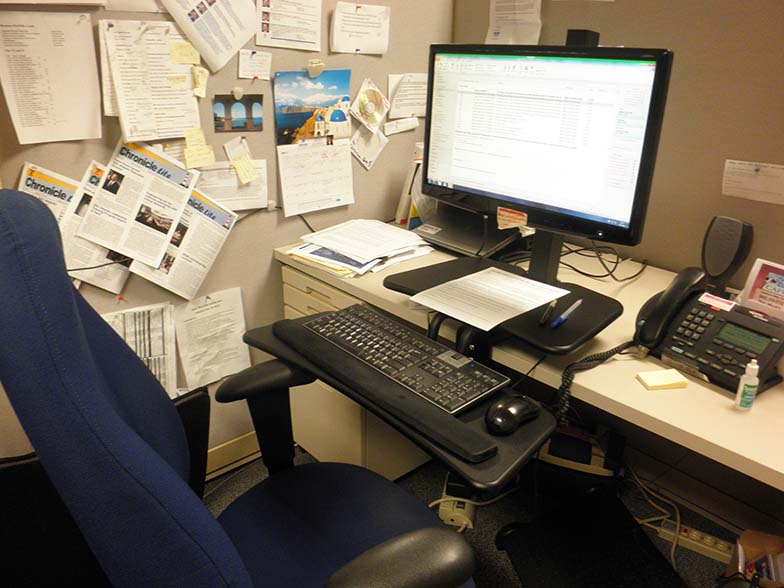
Locate an element on the screen. The width and height of the screenshot is (784, 588). mouse is located at coordinates (499, 400).